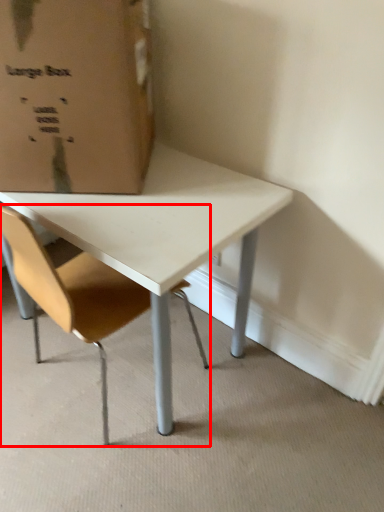
Question: From the image, what is the correct spatial relationship of chair (annotated by the red box) in relation to cardboard box?

Choices:
 (A) left
 (B) right

Answer: (B)